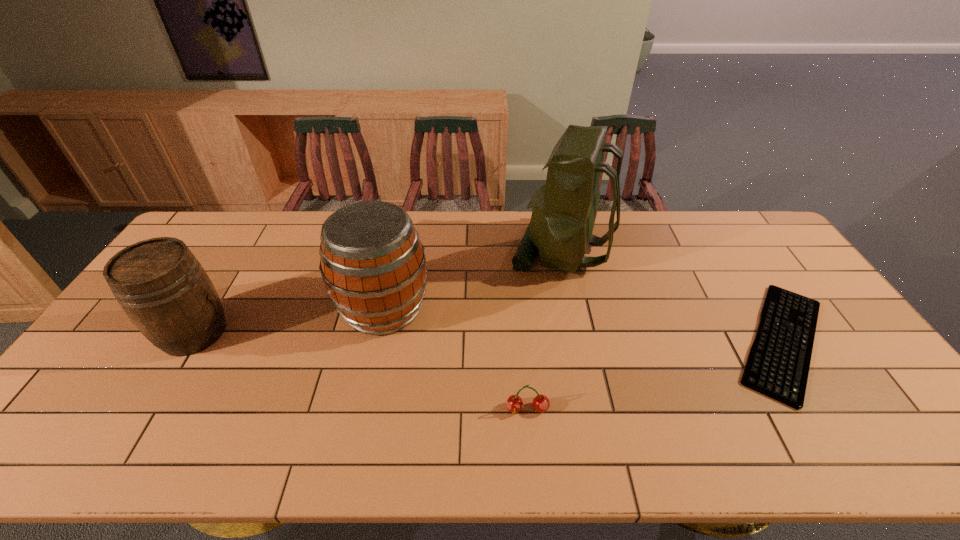
This screenshot has width=960, height=540. I want to click on free spot at the far left corner of the desktop, so click(x=215, y=230).

Image resolution: width=960 pixels, height=540 pixels. In order to click on vacant space at the far right corner in this screenshot , I will do `click(733, 237)`.

The image size is (960, 540). Find the location of `vacant space at the near right corner`. vacant space at the near right corner is located at coordinates tap(921, 433).

Identify the location of vacant space that's between the shorter cider and the second object from left to right. The height and width of the screenshot is (540, 960). (289, 320).

Find the location of `vacant area between the second shortest object and the second object from left to right`. vacant area between the second shortest object and the second object from left to right is located at coordinates (455, 359).

Locate an element on the screen. unoccupied area between the third shortest object and the cherry is located at coordinates (361, 370).

You are a GUI agent. You are given a task and a screenshot of the screen. Output one action in this format:
    pyautogui.click(x=<x>, y=<y>)
    Task: Click on the free space between the left cider and the fourth tallest object
    Image resolution: width=960 pixels, height=540 pixels.
    Given the screenshot: What is the action you would take?
    pyautogui.click(x=361, y=370)

Identify the location of free spot between the cherry and the leftmost object. (361, 370).

Where is `free point between the rightmost object and the tallest object`? free point between the rightmost object and the tallest object is located at coordinates (672, 295).

Where is `vacant area that lies between the rightmost object and the right cider`? The width and height of the screenshot is (960, 540). vacant area that lies between the rightmost object and the right cider is located at coordinates (583, 325).